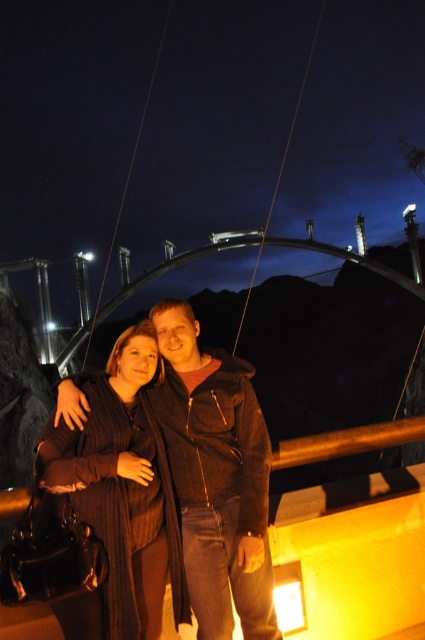
Is dark brown jacket at center behind knitted sweater at center?

Yes, it is.

Is dark brown jacket at center shorter than knitted sweater at center?

In fact, dark brown jacket at center may be taller than knitted sweater at center.

Between point (155, 390) and point (155, 509), which one is positioned in front?

Point (155, 509) is in front.

I want to click on dark brown jacket at center, so click(215, 477).